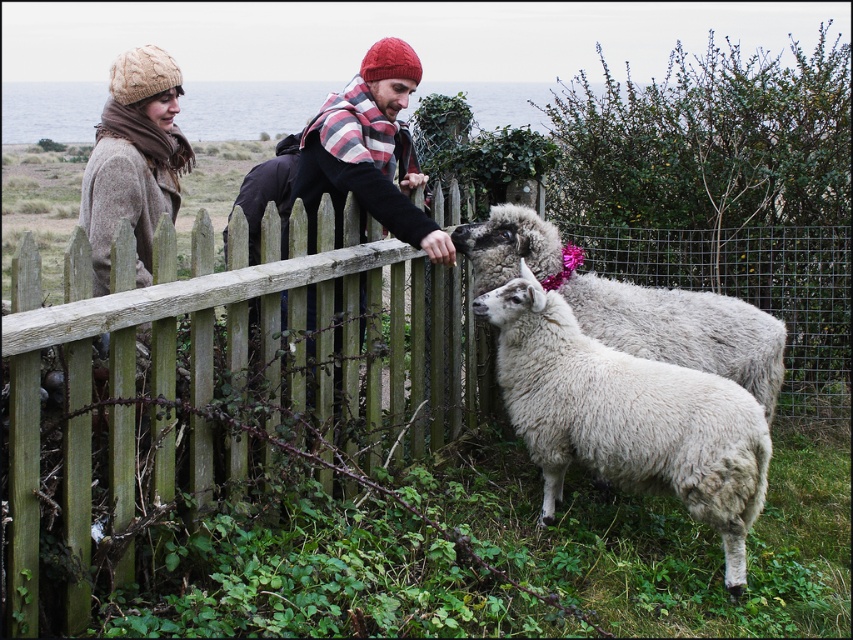
You are standing in front of the wooden fence and notice two points marked on the ground. The first point is at coordinates point (554, 323) and the second point is at point (106, 244). Which of these points is closer to you?

Point (554, 323) is closer to the viewer than point (106, 244).